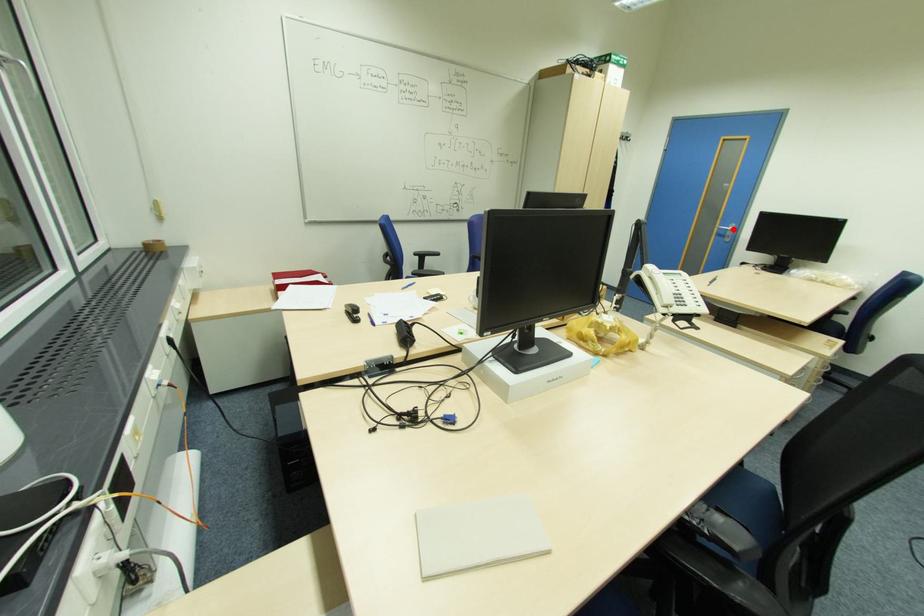
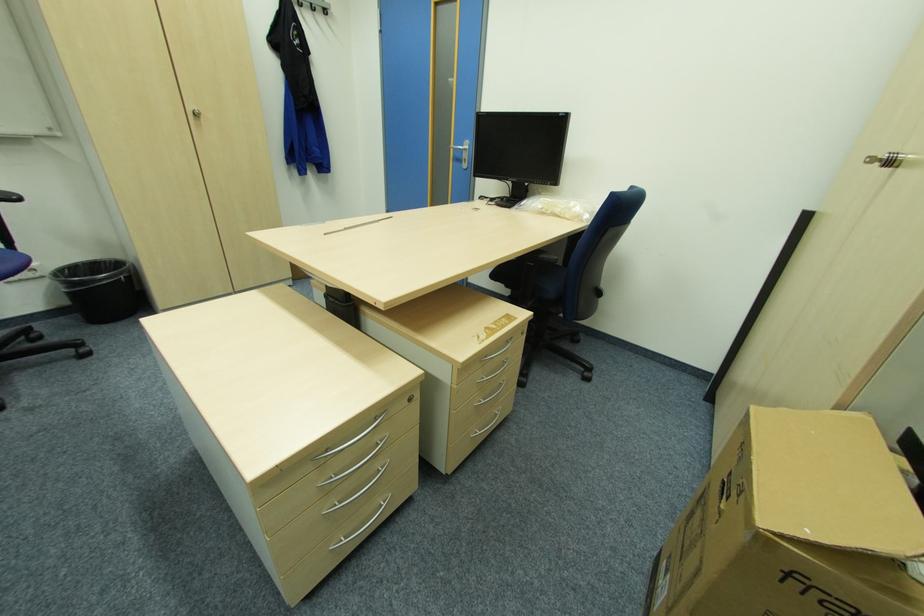
Where in the second image is the point corresponding to the highlighted location from the first image?

(468, 148)